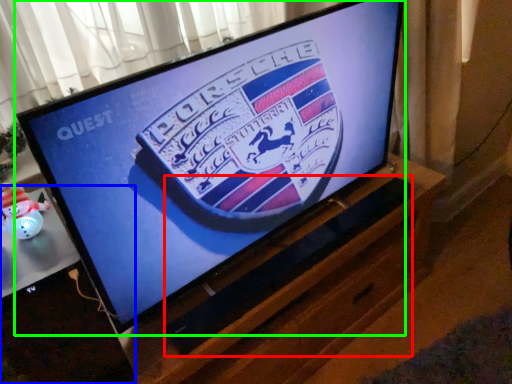
Question: Which object is the farthest from speaker (highlighted by a red box)? Choose among these: desktop (highlighted by a blue box) or television (highlighted by a green box).

Choices:
 (A) desktop
 (B) television

Answer: (A)